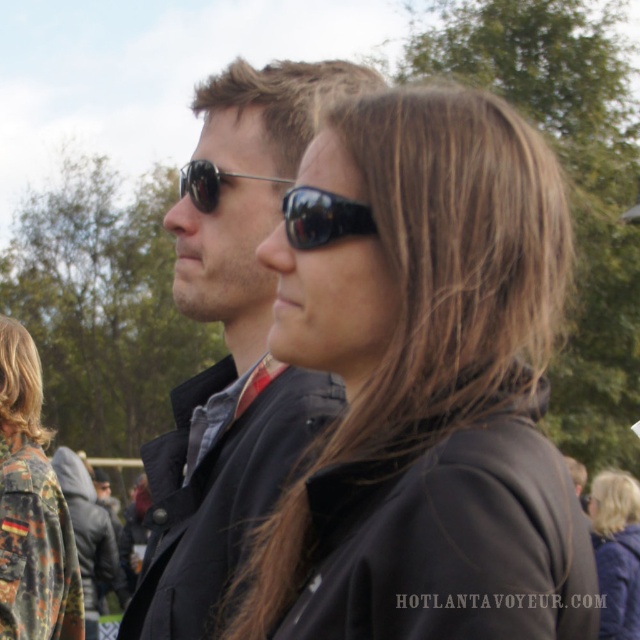
You are a photographer at the event and want to capture a clear shot of the camouflage jacket at lower left. However, the matte black sunglasses at center are blocking your view. Can you adjust your angle to avoid the sunglasses?

The matte black sunglasses at center is positioned over the camouflage jacket at lower left, so moving your camera angle downward might allow you to see the camouflage jacket at lower left without obstruction.

You are a photographer trying to capture a clear photo of the matte black jacket at center and the black reflective sunglasses at center. Since both are at the center, which object should you focus on to ensure it appears sharp and in focus?

The matte black jacket at center has a larger size compared to black reflective sunglasses at center, so focusing on the matte black jacket at center will ensure it appears sharp and in focus.